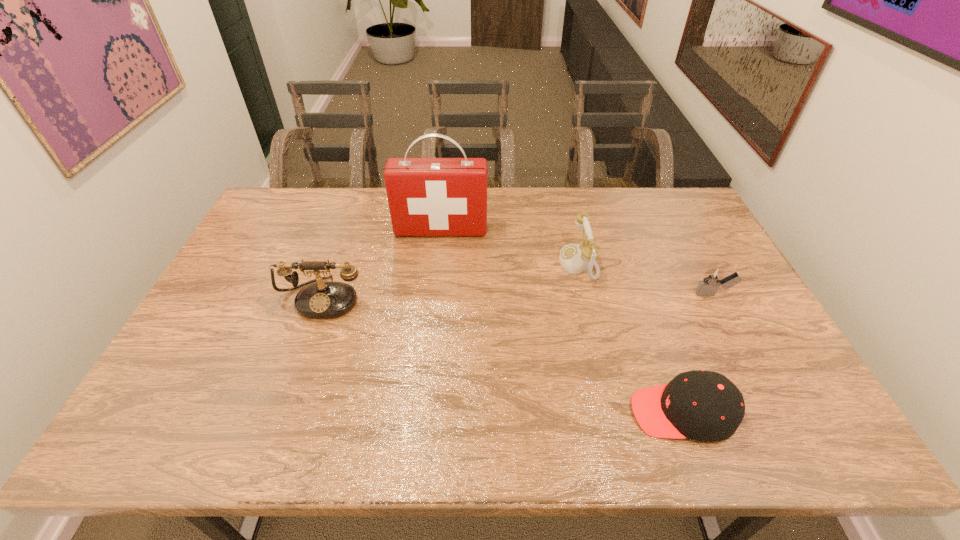
This screenshot has height=540, width=960. Find the location of `free space between the left telephone and the igniter`. free space between the left telephone and the igniter is located at coordinates (518, 296).

Where is `vacant space that's between the right telephone and the leftmost object`? This screenshot has height=540, width=960. vacant space that's between the right telephone and the leftmost object is located at coordinates (450, 280).

In order to click on blank region between the third shortest object and the cap in this screenshot , I will do `click(630, 338)`.

This screenshot has width=960, height=540. Identify the location of unoccupied position between the shorter telephone and the igniter. (646, 279).

Locate an element on the screen. The height and width of the screenshot is (540, 960). object that is the fourth closest to the shorter telephone is located at coordinates (322, 300).

Locate an element on the screen. This screenshot has height=540, width=960. the closest object to the nearest object is located at coordinates (712, 279).